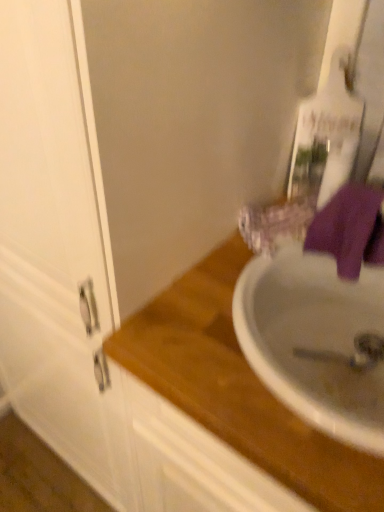
Question: Is wooden at upper right wider or thinner than purple fabric towel at right?

Choices:
 (A) wide
 (B) thin

Answer: (A)

Question: Considering the positions of wooden at upper right and purple fabric towel at right in the image, is wooden at upper right taller or shorter than purple fabric towel at right?

Choices:
 (A) tall
 (B) short

Answer: (A)

Question: From a real-world perspective, is wooden at upper right above or below purple fabric towel at right?

Choices:
 (A) above
 (B) below

Answer: (B)

Question: Is purple fabric towel at right taller or shorter than wooden at upper right?

Choices:
 (A) tall
 (B) short

Answer: (B)

Question: Based on their sizes in the image, would you say purple fabric towel at right is bigger or smaller than wooden at upper right?

Choices:
 (A) big
 (B) small

Answer: (B)

Question: Considering their positions, is purple fabric towel at right located in front of or behind wooden at upper right?

Choices:
 (A) behind
 (B) front

Answer: (A)

Question: Is purple fabric towel at right spatially inside wooden at upper right, or outside of it?

Choices:
 (A) outside
 (B) inside

Answer: (A)